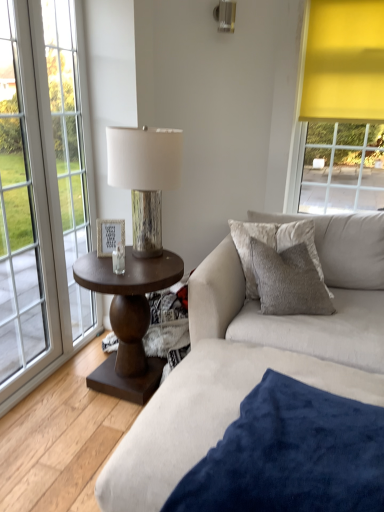
Question: Based on their positions, is velvety blue blanket at lower right located to the left or right of dark wood side table at center?

Choices:
 (A) left
 (B) right

Answer: (B)

Question: Looking at the image, does velvety blue blanket at lower right seem bigger or smaller compared to dark wood side table at center?

Choices:
 (A) small
 (B) big

Answer: (B)

Question: Which object is the farthest from the textured beige couch at center?

Choices:
 (A) wooden lampshade at center
 (B) white wood picture frame at center
 (C) white glass window at left
 (D) velvet gray pillow at center
 (E) velvety blue blanket at lower right

Answer: (C)

Question: Based on their relative distances, which object is farther from the textured beige couch at center?

Choices:
 (A) velvet gray pillow at center
 (B) white wood picture frame at center
 (C) white glass window at left
 (D) dark wood side table at center
 (E) velvety blue blanket at lower right

Answer: (C)